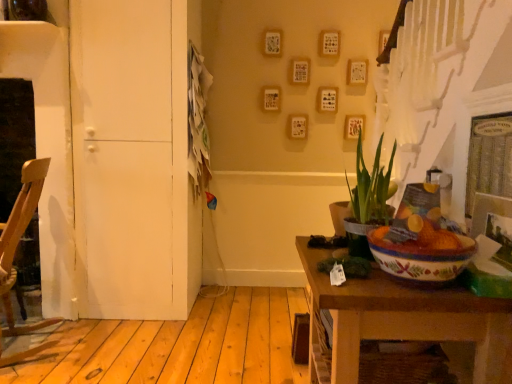
I want to click on vacant space in front of white matte door at left, so [x=131, y=345].